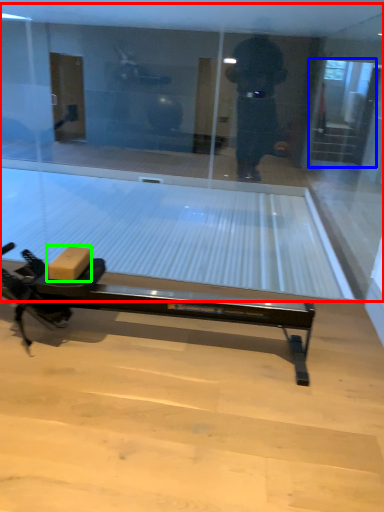
Question: Which object is positioned closest to shop window (highlighted by a red box)? Select from screen door (highlighted by a blue box) and cardboard box (highlighted by a green box).

Choices:
 (A) screen door
 (B) cardboard box

Answer: (B)